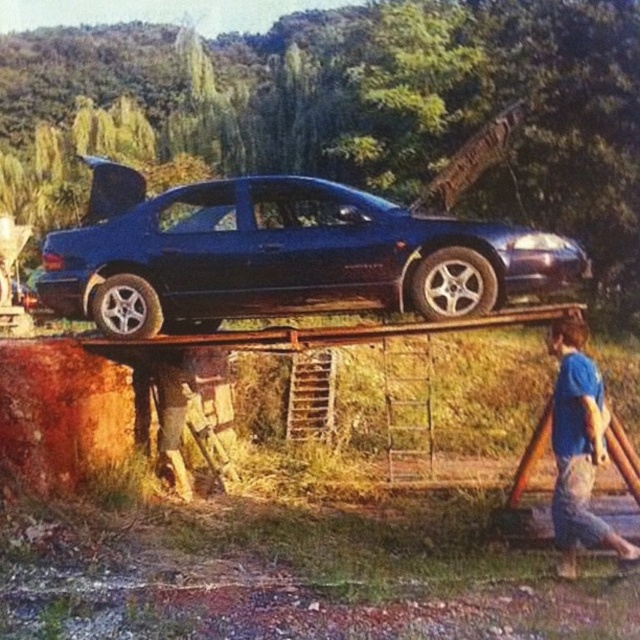
Question: Which object is farther from the camera taking this photo?

Choices:
 (A) glossy blue sedan at center
 (B) blue cotton shirt at lower right

Answer: (A)

Question: Among these objects, which one is nearest to the camera?

Choices:
 (A) blue cotton shirt at lower right
 (B) glossy blue sedan at center

Answer: (A)

Question: Can you confirm if glossy blue sedan at center is positioned to the right of blue cotton shirt at lower right?

Choices:
 (A) yes
 (B) no

Answer: (B)

Question: Which point is closer to the camera?

Choices:
 (A) (554, 419)
 (B) (269, 209)

Answer: (A)

Question: Is glossy blue sedan at center positioned at the back of blue cotton shirt at lower right?

Choices:
 (A) no
 (B) yes

Answer: (B)

Question: Is glossy blue sedan at center to the right of blue cotton shirt at lower right from the viewer's perspective?

Choices:
 (A) no
 (B) yes

Answer: (A)